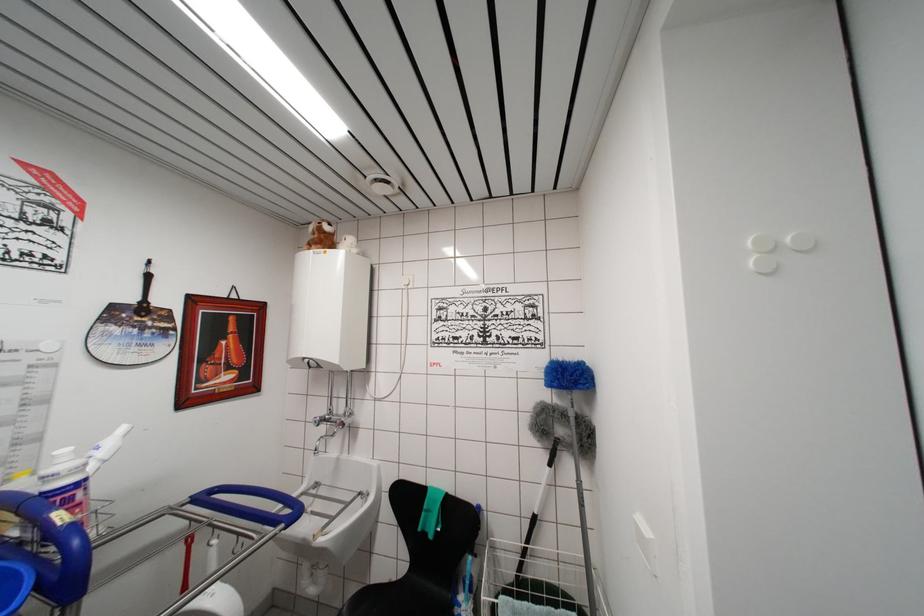
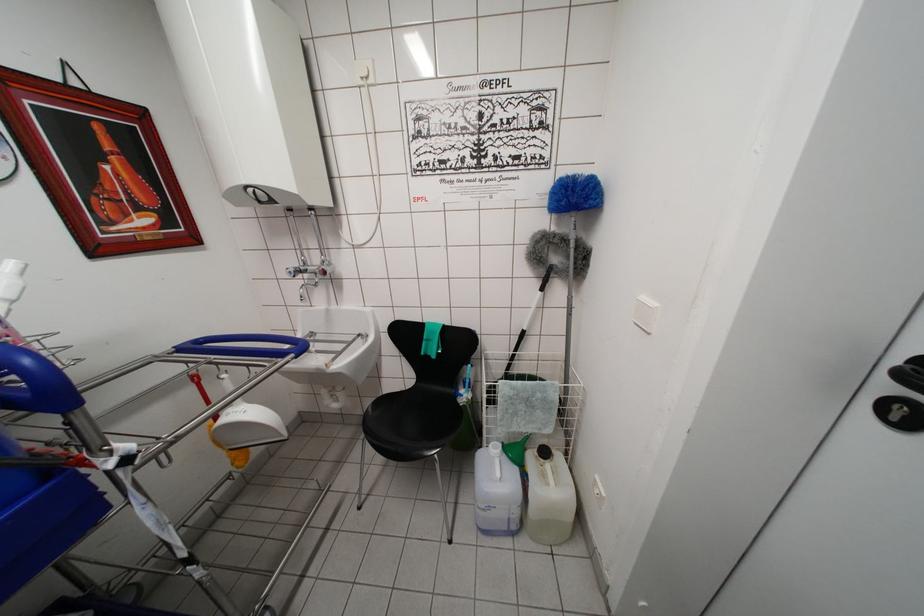
Locate, in the second image, the point that corresponds to (x=554, y=387) in the first image.

(562, 206)